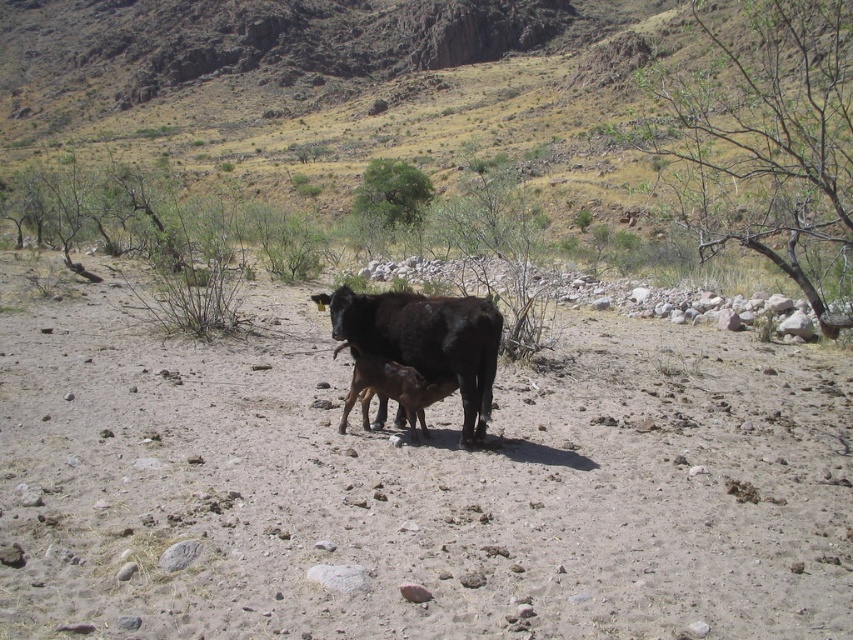
You are navigating a drone over the arid landscape and need to land it precisely on the dull brown grassland at center. What are the coordinates where you should direct the drone to land?

The coordinates for the dull brown grassland at center are point (289, 54), so you should direct the drone to land there.

You are a farmer checking the field. You see the dull brown grassland at center and the black glossy cow at center. Which one is wider?

The dull brown grassland at center is wider than the black glossy cow at center.